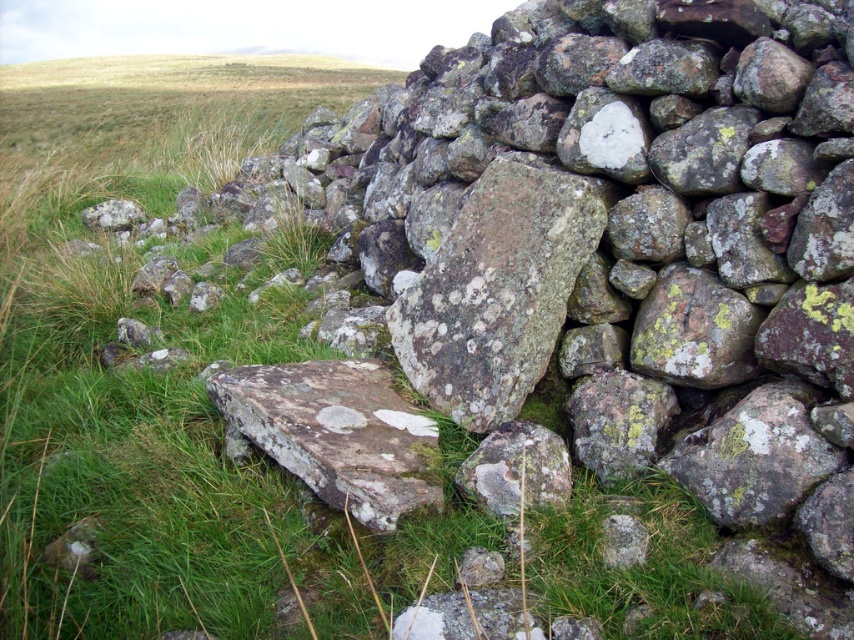
You are standing in front of a dry stone wall and notice two rocks at the center. The speckled rock at center and the rusty brown rock at center. Which rock is closer to you?

The speckled rock at center is closer to you because it is further to the viewer than the rusty brown rock at center.

Consider the image. You are standing in front of a dry stone wall and see two speckled rocks. One is labeled as the speckled rock at center and the other as the speckled rock at lower center. From your perspective, which rock is positioned to the left of the other?

The speckled rock at center is to the left of the speckled rock at lower center.

You are standing in front of a dry stone wall and notice a speckled rock at center. Based on its position, can you determine if it is closer to the top or bottom of the wall?

The speckled rock at center is located at point coordinates 0.450 on the x axis and 0.582 on the y axis. Since the y coordinate is higher than 0.5, it is closer to the top of the wall.